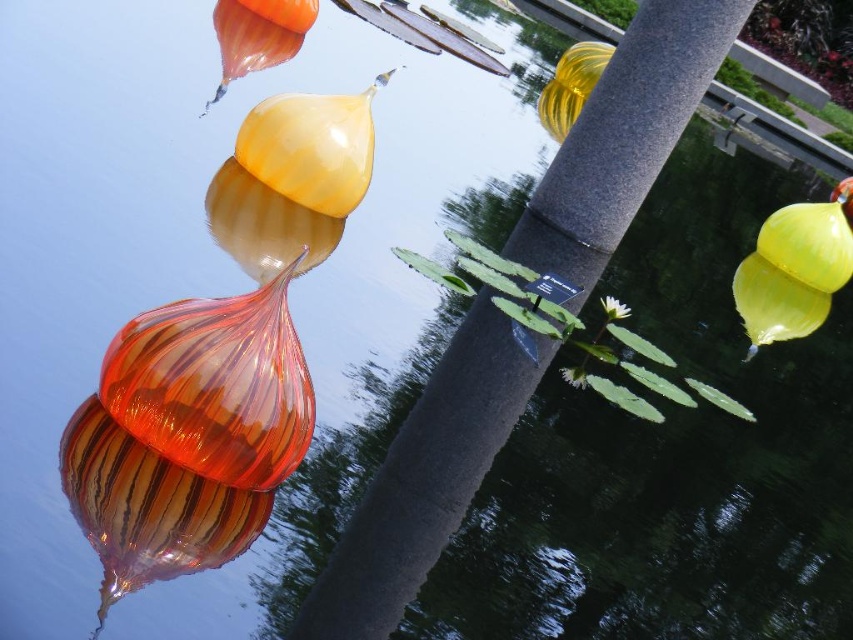
Between point (254, 180) and point (567, 368), which one is positioned in front?

Positioned in front is point (567, 368).

Which is above, translucent amber glass vase at center or white glossy flower at center?

translucent amber glass vase at center is higher up.

You are a GUI agent. You are given a task and a screenshot of the screen. Output one action in this format:
    pyautogui.click(x=<x>, y=<y>)
    Task: Click on the translucent amber glass vase at center
    This screenshot has width=853, height=640.
    Given the screenshot: What is the action you would take?
    pos(264,225)

Which of these two, translucent amber glass vase at center or white matte flower at center, stands taller?

Standing taller between the two is translucent amber glass vase at center.

Measure the distance between point (239, 216) and camera.

Point (239, 216) is 7.42 feet away from camera.

The height and width of the screenshot is (640, 853). Find the location of `translucent amber glass vase at center`. translucent amber glass vase at center is located at coordinates (264, 225).

Does white matte flower at center have a greater width compared to white glossy flower at center?

Yes.

Is white matte flower at center taller than white glossy flower at center?

Yes.

Find the location of a particular element. white matte flower at center is located at coordinates (614, 307).